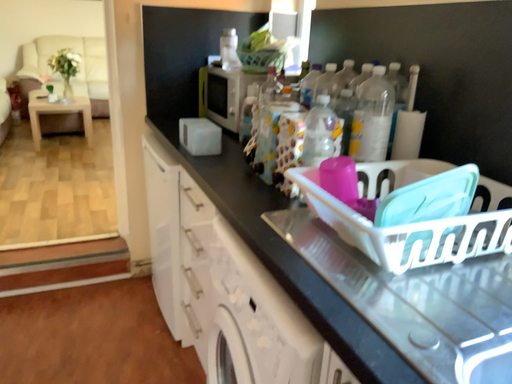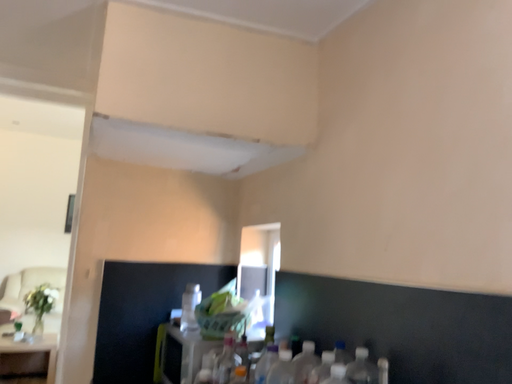
Question: Which way did the camera rotate in the video?

Choices:
 (A) rotated downward
 (B) rotated upward

Answer: (B)